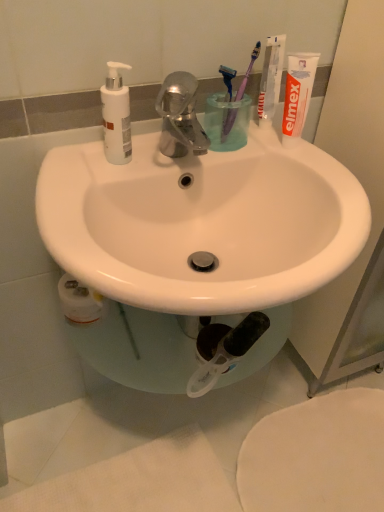
Consider the image. Measure the distance between point (305, 407) and camera.

They are 4.32 feet apart.

This screenshot has width=384, height=512. Describe the element at coordinates (316, 456) in the screenshot. I see `white matte bidet at lower right` at that location.

Where is `white matte tube of toothpaste at upper right, which is the second toothpaste in left-to-right order`? white matte tube of toothpaste at upper right, which is the second toothpaste in left-to-right order is located at coordinates (297, 94).

Describe the element at coordinates (248, 71) in the screenshot. I see `purple plastic toothbrush at upper right, the second toothbrush viewed from the left` at that location.

What do you see at coordinates (116, 116) in the screenshot?
I see `white matte pump bottle at upper left` at bounding box center [116, 116].

I want to click on white glossy sink at center, so click(202, 223).

From a real-world perspective, is white glossy sink at center physically below white matte bidet at lower right?

No, from a real-world perspective, white glossy sink at center is not below white matte bidet at lower right.

Is white glossy sink at center further to camera compared to white matte bidet at lower right?

No.

Considering the sizes of objects white glossy sink at center and white matte bidet at lower right in the image provided, who is thinner, white glossy sink at center or white matte bidet at lower right?

With smaller width is white matte bidet at lower right.

From a real-world perspective, which is physically above, white matte tube of toothpaste at upper right, the first toothpaste when ordered from right to left, or transparent plastic cup at center?

From a 3D spatial view, white matte tube of toothpaste at upper right, the first toothpaste when ordered from right to left, is above.

Is there a large distance between white matte tube of toothpaste at upper right, the first toothpaste when ordered from right to left, and transparent plastic cup at center?

No, white matte tube of toothpaste at upper right, the first toothpaste when ordered from right to left, is in close proximity to transparent plastic cup at center.

Which is behind, point (306, 114) or point (212, 144)?

The point (306, 114) is farther from the camera.

Which object is thinner, white matte pump bottle at upper left or purple plastic toothbrush at upper right, positioned as the first toothbrush in left-to-right order?

purple plastic toothbrush at upper right, positioned as the first toothbrush in left-to-right order.

From the picture: Does white matte pump bottle at upper left turn towards purple plastic toothbrush at upper right, positioned as the first toothbrush in left-to-right order?

No, white matte pump bottle at upper left is not turned towards purple plastic toothbrush at upper right, positioned as the first toothbrush in left-to-right order.

How different are the orientations of white matte pump bottle at upper left and purple plastic toothbrush at upper right, which is the 2th toothbrush from right to left, in degrees?

They differ by 1.52 degrees in their facing directions.

Is white matte pump bottle at upper left to the right of purple plastic toothbrush at upper right, which is the 2th toothbrush from right to left, from the viewer's perspective?

In fact, white matte pump bottle at upper left is to the left of purple plastic toothbrush at upper right, which is the 2th toothbrush from right to left.

Is point (339, 430) closer or farther from the camera than point (230, 124)?

Point (339, 430) appears to be farther away from the viewer than point (230, 124).

How far apart are white matte bidet at lower right and purple plastic toothbrush at upper right, positioned as the first toothbrush in left-to-right order?

A distance of 36.86 inches exists between white matte bidet at lower right and purple plastic toothbrush at upper right, positioned as the first toothbrush in left-to-right order.

From the picture: From a real-world perspective, is white matte bidet at lower right above or below purple plastic toothbrush at upper right, which is the 2th toothbrush from right to left?

white matte bidet at lower right is situated lower than purple plastic toothbrush at upper right, which is the 2th toothbrush from right to left, in the real world.

From the picture: Considering the relative positions of white matte bidet at lower right and purple plastic toothbrush at upper right, positioned as the first toothbrush in left-to-right order, in the image provided, is white matte bidet at lower right to the left of purple plastic toothbrush at upper right, positioned as the first toothbrush in left-to-right order, from the viewer's perspective?

In fact, white matte bidet at lower right is to the right of purple plastic toothbrush at upper right, positioned as the first toothbrush in left-to-right order.

Who is bigger, purple plastic toothbrush at upper right, which ranks as the 1th toothbrush in right-to-left order, or purple plastic toothbrush at upper right, positioned as the first toothbrush in left-to-right order?

purple plastic toothbrush at upper right, which ranks as the 1th toothbrush in right-to-left order.

Is purple plastic toothbrush at upper right, the second toothbrush viewed from the left, positioned far away from purple plastic toothbrush at upper right, which is the 2th toothbrush from right to left?

That's not correct — purple plastic toothbrush at upper right, the second toothbrush viewed from the left, is a little close to purple plastic toothbrush at upper right, which is the 2th toothbrush from right to left.

From the image's perspective, is purple plastic toothbrush at upper right, the second toothbrush viewed from the left, under purple plastic toothbrush at upper right, positioned as the first toothbrush in left-to-right order?

No, from the image's perspective, purple plastic toothbrush at upper right, the second toothbrush viewed from the left, is not beneath purple plastic toothbrush at upper right, positioned as the first toothbrush in left-to-right order.

From the picture: From a real-world perspective, is white matte tube of toothpaste at upper right, which is the second toothpaste in left-to-right order, positioned under white glossy toothpaste at upper right, the 2th toothpaste from the right, based on gravity?

Correct, in the physical world, white matte tube of toothpaste at upper right, which is the second toothpaste in left-to-right order, is lower than white glossy toothpaste at upper right, the 2th toothpaste from the right.

Which point is more forward, (308, 91) or (268, 48)?

The point (308, 91) is in front.

You are a GUI agent. You are given a task and a screenshot of the screen. Output one action in this format:
    pyautogui.click(x=<x>, y=<y>)
    Task: Click on the toothpaste above the white matte tube of toothpaste at upper right, the first toothpaste when ordered from right to left (from the image's perspective)
    
    Given the screenshot: What is the action you would take?
    pyautogui.click(x=271, y=76)

This screenshot has height=512, width=384. What are the coordinates of `bidet below the white matte pump bottle at upper left (from a real-world perspective)` in the screenshot? It's located at (316, 456).

Which object is closer to the camera taking this photo, white matte pump bottle at upper left or white matte bidet at lower right?

white matte pump bottle at upper left is in front.

Does white matte pump bottle at upper left turn towards white matte bidet at lower right?

No, white matte pump bottle at upper left is not facing towards white matte bidet at lower right.

Which is correct: white matte pump bottle at upper left is inside white matte bidet at lower right, or outside of it?

white matte pump bottle at upper left is outside white matte bidet at lower right.

Find the location of `sink in front of the white matte bidet at lower right`. sink in front of the white matte bidet at lower right is located at coordinates (202, 223).

The height and width of the screenshot is (512, 384). I want to click on the 2nd toothpaste to the right of the transparent plastic cup at center, counting from the anchor's position, so click(x=297, y=94).

Looking at the image, which one is located further to white matte pump bottle at upper left, white glossy toothpaste at upper right, the first toothpaste viewed from the left, or transparent plastic cup at center?

white glossy toothpaste at upper right, the first toothpaste viewed from the left, is further to white matte pump bottle at upper left.

Considering their positions, is purple plastic toothbrush at upper right, which is the 2th toothbrush from right to left, positioned further to purple plastic toothbrush at upper right, the second toothbrush viewed from the left, than white matte bidet at lower right?

The object further to purple plastic toothbrush at upper right, the second toothbrush viewed from the left, is white matte bidet at lower right.

From the image, which object appears to be farther from transparent plastic cup at center, purple plastic toothbrush at upper right, which is the 2th toothbrush from right to left, or white glossy toothpaste at upper right, the 2th toothpaste from the right?

white glossy toothpaste at upper right, the 2th toothpaste from the right, is further to transparent plastic cup at center.

Considering their positions, is purple plastic toothbrush at upper right, which is the 2th toothbrush from right to left, positioned further to white glossy sink at center than transparent plastic cup at center?

purple plastic toothbrush at upper right, which is the 2th toothbrush from right to left.

From the image, which object appears to be farther from white glossy sink at center, purple plastic toothbrush at upper right, positioned as the first toothbrush in left-to-right order, or white glossy toothpaste at upper right, the 2th toothpaste from the right?

Among the two, white glossy toothpaste at upper right, the 2th toothpaste from the right, is located further to white glossy sink at center.

Looking at the image, which one is located further to white matte bidet at lower right, white glossy sink at center or white matte pump bottle at upper left?

The object further to white matte bidet at lower right is white matte pump bottle at upper left.

Which object lies further to the anchor point white matte tube of toothpaste at upper right, which is the second toothpaste in left-to-right order, purple plastic toothbrush at upper right, positioned as the first toothbrush in left-to-right order, or transparent plastic cup at center?

The object further to white matte tube of toothpaste at upper right, which is the second toothpaste in left-to-right order, is purple plastic toothbrush at upper right, positioned as the first toothbrush in left-to-right order.

From the image, which object appears to be farther from white glossy toothpaste at upper right, the 2th toothpaste from the right, white matte tube of toothpaste at upper right, which is the second toothpaste in left-to-right order, or purple plastic toothbrush at upper right, the second toothbrush viewed from the left?

Based on the image, white matte tube of toothpaste at upper right, which is the second toothpaste in left-to-right order, appears to be further to white glossy toothpaste at upper right, the 2th toothpaste from the right.

This screenshot has width=384, height=512. What are the coordinates of `toothbrush between transparent plastic cup at center and white glossy toothpaste at upper right, the 2th toothpaste from the right, in the horizontal direction` in the screenshot? It's located at (248, 71).

Locate an element on the screen. This screenshot has width=384, height=512. liquid between purple plastic toothbrush at upper right, which ranks as the 1th toothbrush in right-to-left order, and white matte bidet at lower right from top to bottom is located at coordinates (227, 122).

The height and width of the screenshot is (512, 384). Identify the location of toothbrush situated between white matte pump bottle at upper left and purple plastic toothbrush at upper right, which ranks as the 1th toothbrush in right-to-left order, from left to right. (228, 124).

Find the location of a particular element. soap dispenser between purple plastic toothbrush at upper right, positioned as the first toothbrush in left-to-right order, and white matte bidet at lower right from top to bottom is located at coordinates (116, 116).